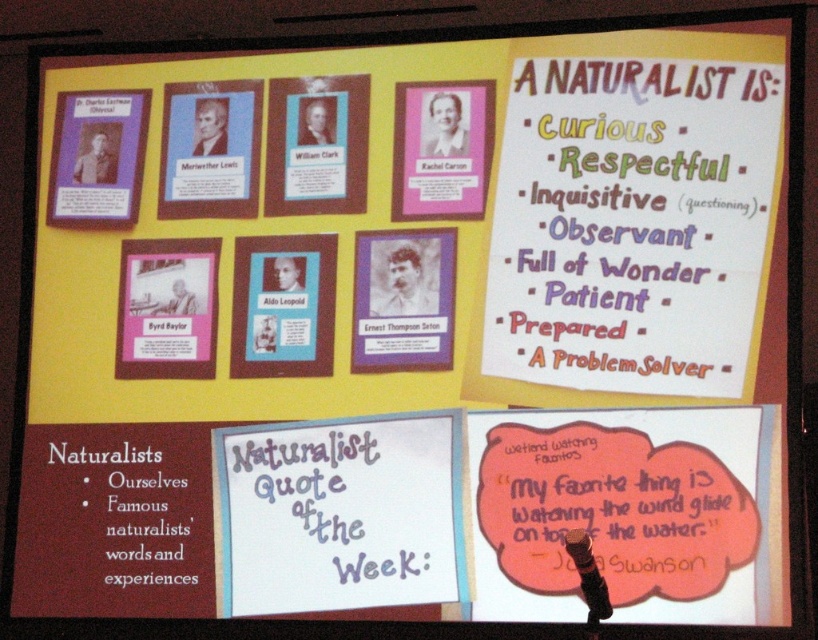
Describe the element at coordinates (335, 508) in the screenshot. The height and width of the screenshot is (640, 818). I see `purple paper at center` at that location.

Does purple paper at center have a greater width compared to pink paper rachel carson portrait at upper center?

Yes, purple paper at center is wider than pink paper rachel carson portrait at upper center.

Locate an element on the screen. purple paper at center is located at coordinates (335, 508).

Could you measure the distance between white paper at upper right and pink paper rachel carson portrait at upper center?

The distance of white paper at upper right from pink paper rachel carson portrait at upper center is 17.02 inches.

Consider the image. Who is more forward, (x=522, y=56) or (x=441, y=99)?

Point (x=522, y=56) is in front.

Locate an element on the screen. This screenshot has height=640, width=818. white paper at upper right is located at coordinates (632, 224).

Can you confirm if white paper at upper right is smaller than matte purple card at upper left?

Incorrect, white paper at upper right is not smaller in size than matte purple card at upper left.

Which is above, white paper at upper right or matte purple card at upper left?

matte purple card at upper left

Which is in front, point (641, 369) or point (136, 198)?

Point (641, 369) is more forward.

Find the location of a particular element. The image size is (818, 640). white paper at upper right is located at coordinates (632, 224).